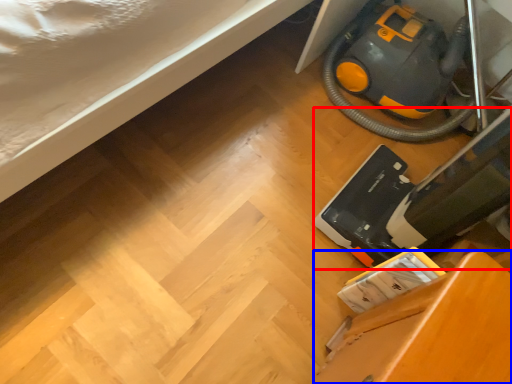
Question: Which object is closer to the camera taking this photo, equipment (highlighted by a red box) or furniture (highlighted by a blue box)?

Choices:
 (A) equipment
 (B) furniture

Answer: (B)